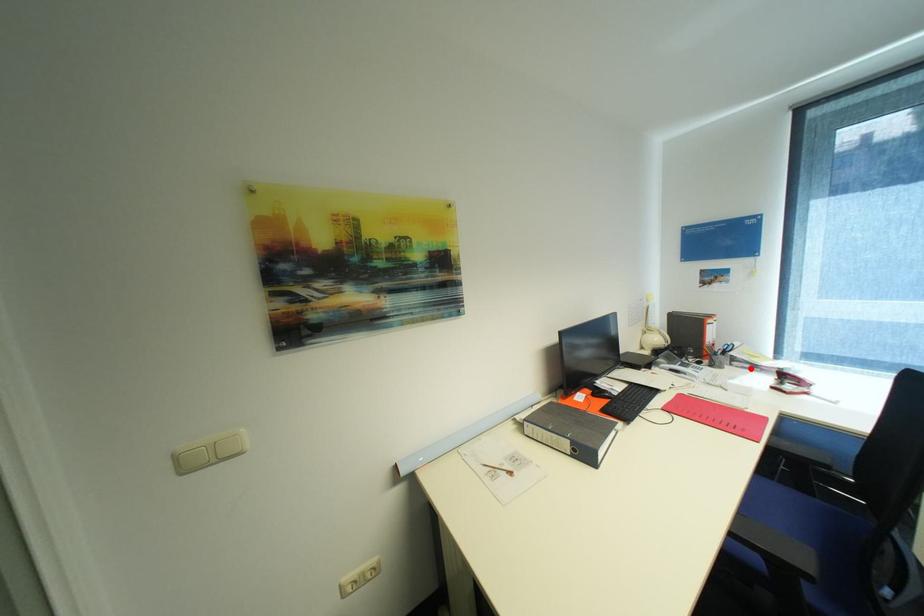
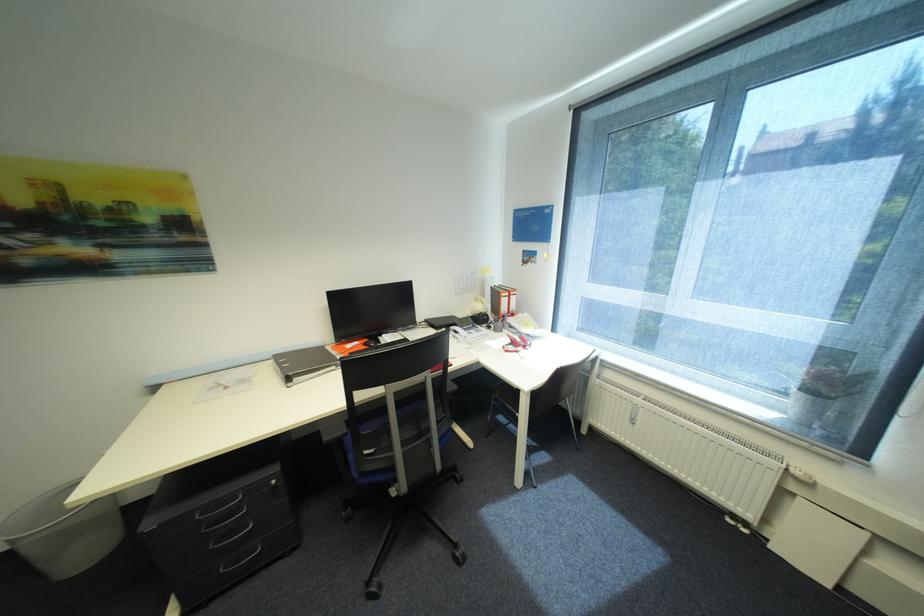
The point at the highlighted location is marked in the first image. Where is the corresponding point in the second image?

(521, 333)